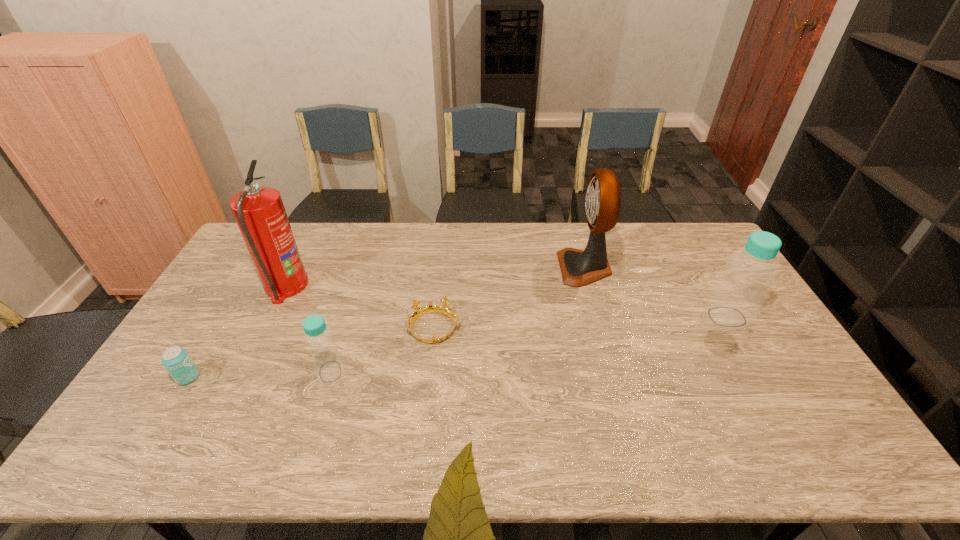
Identify the location of unoccupied area between the fifth object from right to left and the shortest object. Image resolution: width=960 pixels, height=540 pixels. (360, 307).

You are a GUI agent. You are given a task and a screenshot of the screen. Output one action in this format:
    pyautogui.click(x=<x>, y=<y>)
    Task: Click on the free point between the second shortest object and the fan
    Image resolution: width=960 pixels, height=540 pixels.
    Given the screenshot: What is the action you would take?
    click(x=386, y=322)

Locate an element on the screen. vacant area that lies between the third object from right to left and the fan is located at coordinates pyautogui.click(x=509, y=298).

Where is `vacant point located between the leftmost object and the second object from left to right`? vacant point located between the leftmost object and the second object from left to right is located at coordinates (237, 332).

Find the location of a particular element. The width and height of the screenshot is (960, 540). vacant point located between the shorter bottle and the crown is located at coordinates (382, 350).

Locate an element on the screen. vacant area between the fifth object from left to right and the fifth tallest object is located at coordinates (386, 322).

Where is `object that ranks as the fifth closest to the crown`? The height and width of the screenshot is (540, 960). object that ranks as the fifth closest to the crown is located at coordinates (738, 294).

Identify which object is the third closest to the nearer bottle. Please provide its 2D coordinates. Your answer should be formatted as a tuple, i.e. [(x, y)], where the tuple contains the x and y coordinates of a point satisfying the conditions above.

[(176, 360)]

What are the coordinates of `free spot that satisfies the following two spatial constraints: 1. on the instruction side of the fifth object from right to left; 2. on the left side of the fourth shortest object` in the screenshot? It's located at (271, 317).

The image size is (960, 540). In order to click on vacant position in the image that satisfies the following two spatial constraints: 1. on the front-facing side of the taller bottle; 2. on the left side of the second object from right to left in this screenshot , I will do `click(598, 317)`.